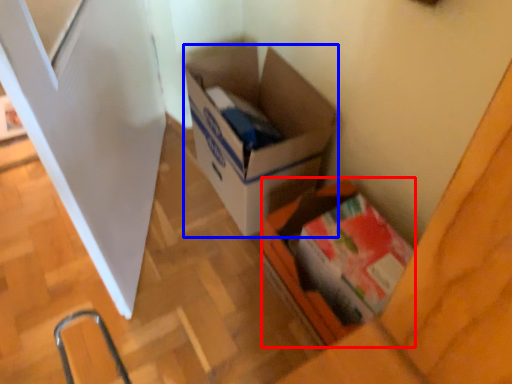
Question: Which point is closer to the camera, box (highlighted by a red box) or box (highlighted by a blue box)?

Choices:
 (A) box
 (B) box

Answer: (A)